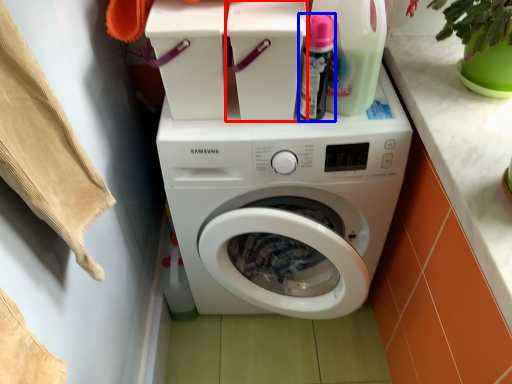
Question: Which point is closer to the camera, appliance (highlighted by a red box) or cleaning product (highlighted by a blue box)?

Choices:
 (A) appliance
 (B) cleaning product

Answer: (B)